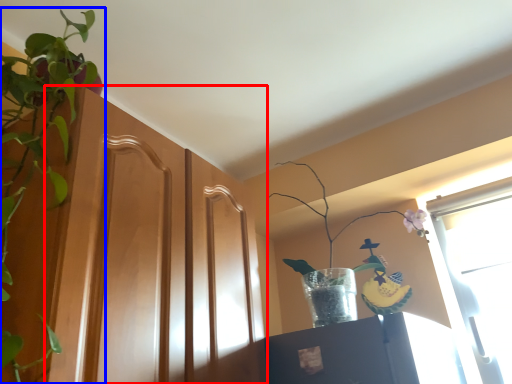
Question: Which of the following is the farthest to the observer, screen door (highlighted by a red box) or houseplant (highlighted by a blue box)?

Choices:
 (A) screen door
 (B) houseplant

Answer: (A)